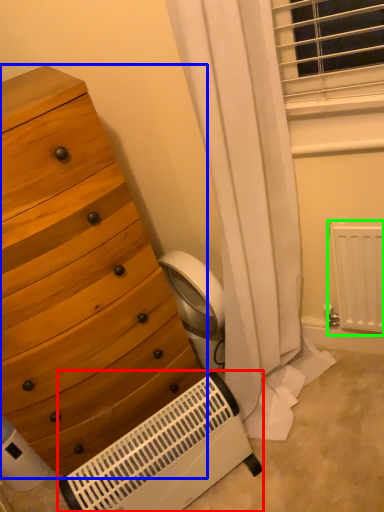
Question: Based on their relative distances, which object is nearer to heater (highlighted by a red box)? Choose from chest of drawers (highlighted by a blue box) and radiator (highlighted by a green box).

Choices:
 (A) chest of drawers
 (B) radiator

Answer: (A)